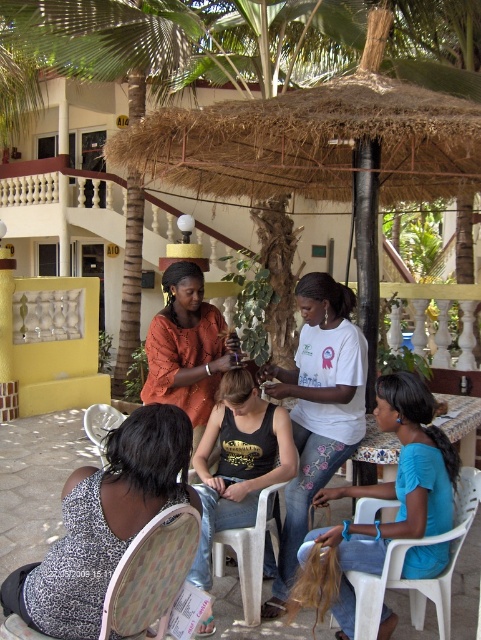
You are a guest at the resort and want to sit in the patterned fabric chair at lower left to get a haircut. However, there is blue fabric hair at lower right in the way. Can you move the chair forward to access it?

The patterned fabric chair at lower left is behind the blue fabric hair at lower right, so moving it forward would allow you to access the chair without obstruction.

You are a photographer positioned at the point with coordinates (239, 461). You want to capture a photo of the black tank top at center. Can you confirm if you are currently standing directly at the location of the black tank top at center?

Yes, you are standing directly at the location of the black tank top at center since the point (239, 461) is where the black tank top at center is located.

You are a photographer setting up a shoot under the thatched roof. You notice the blue fabric hair at lower right and the patterned fabric chair at lower left. Which object is taller when viewed from the photographer position?

The blue fabric hair at lower right is taller than the patterned fabric chair at lower left according to the description.